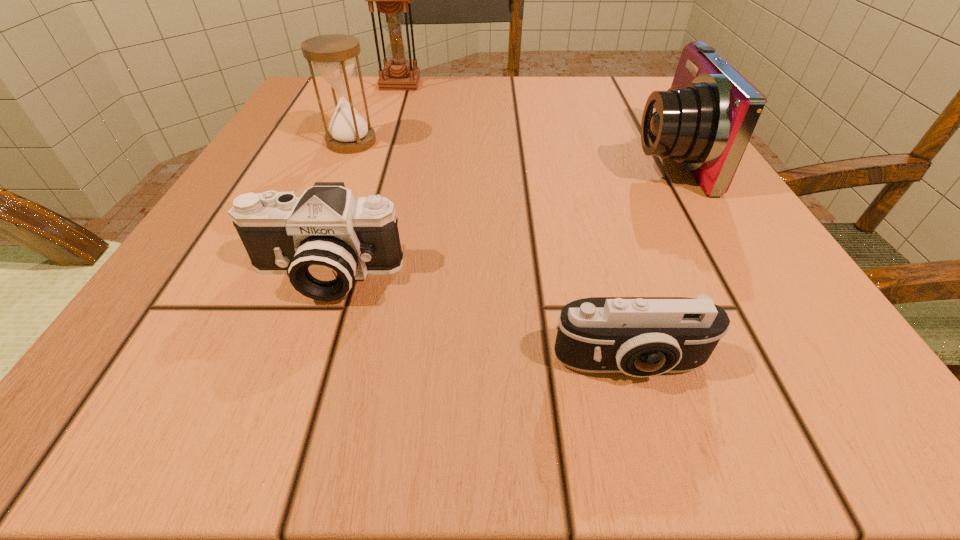
Image resolution: width=960 pixels, height=540 pixels. Find the location of `object at the near right corner`. object at the near right corner is located at coordinates (641, 337).

Image resolution: width=960 pixels, height=540 pixels. In the image, there is a desktop. Identify the location of free space at the far edge. (467, 84).

This screenshot has height=540, width=960. I want to click on vacant space at the near edge of the desktop, so click(x=373, y=345).

The height and width of the screenshot is (540, 960). Identify the location of free region at the left edge. (277, 327).

At what (x,y) coordinates should I click in order to perform the action: click on free space at the right edge of the desktop. Please return your answer as a coordinate pair (x, y). Looking at the image, I should click on (627, 188).

Where is `free space at the far left corner`? The width and height of the screenshot is (960, 540). free space at the far left corner is located at coordinates (294, 102).

Where is `vacant space at the near left corner of the desktop`? The image size is (960, 540). vacant space at the near left corner of the desktop is located at coordinates (200, 414).

Image resolution: width=960 pixels, height=540 pixels. Identify the location of vacant space at the far right corner of the desktop. (610, 123).

In the image, there is a desktop. Where is `vacant area at the near right corner`? Image resolution: width=960 pixels, height=540 pixels. vacant area at the near right corner is located at coordinates (829, 408).

Where is `unoccupied area between the second shortest camera and the farther hourglass`? unoccupied area between the second shortest camera and the farther hourglass is located at coordinates (362, 179).